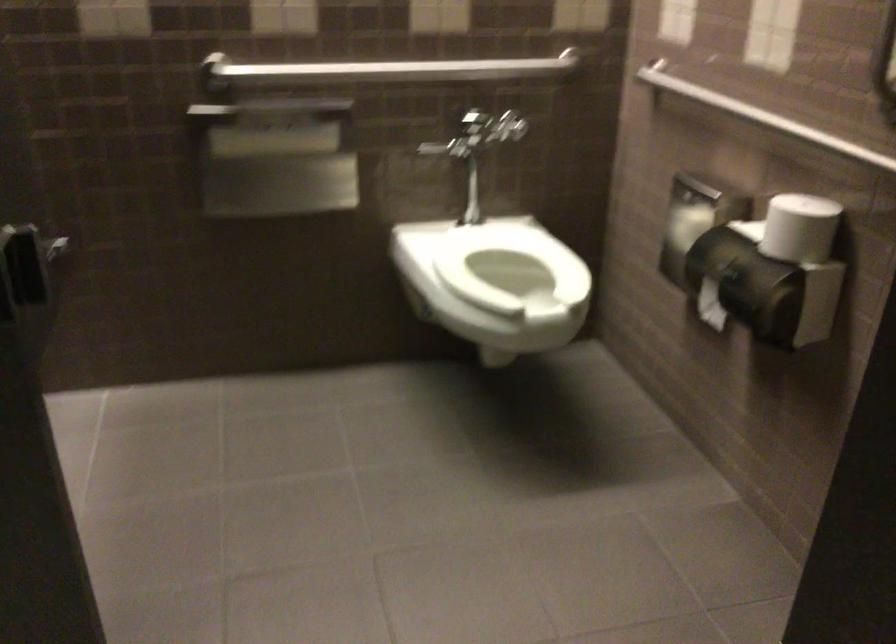
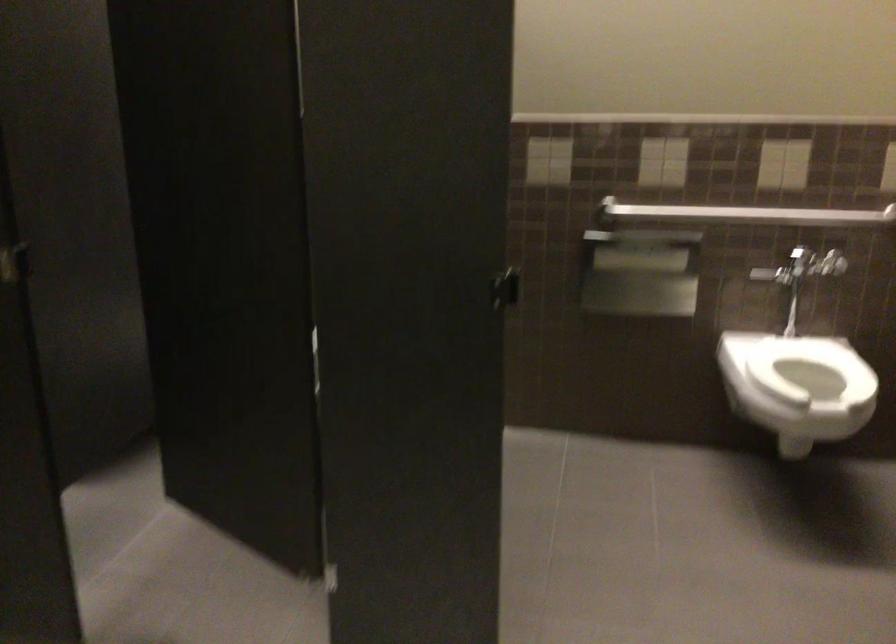
Locate, in the second image, the point that corresponds to pixel 490 267 in the first image.

(810, 368)